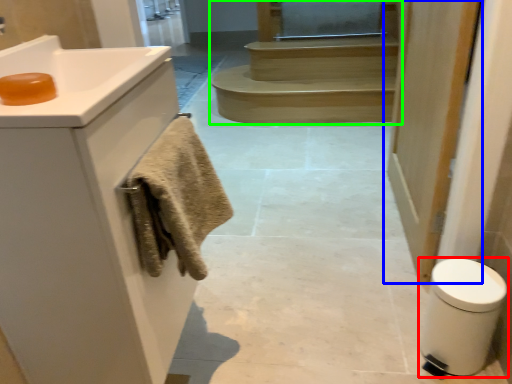
Question: Which object is positioned closest to bidet (highlighted by a red box)? Select from door (highlighted by a blue box) and stairs (highlighted by a green box).

Choices:
 (A) door
 (B) stairs

Answer: (A)